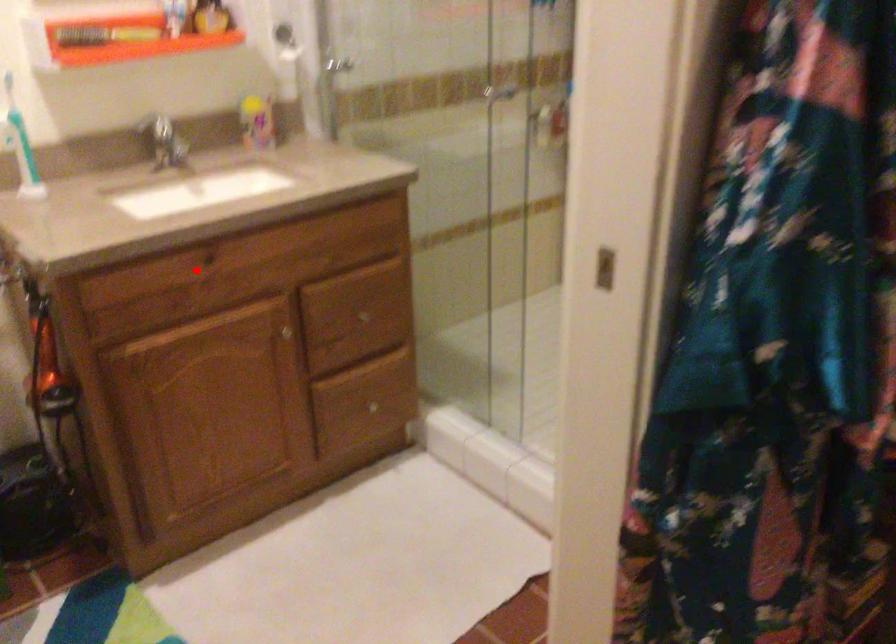
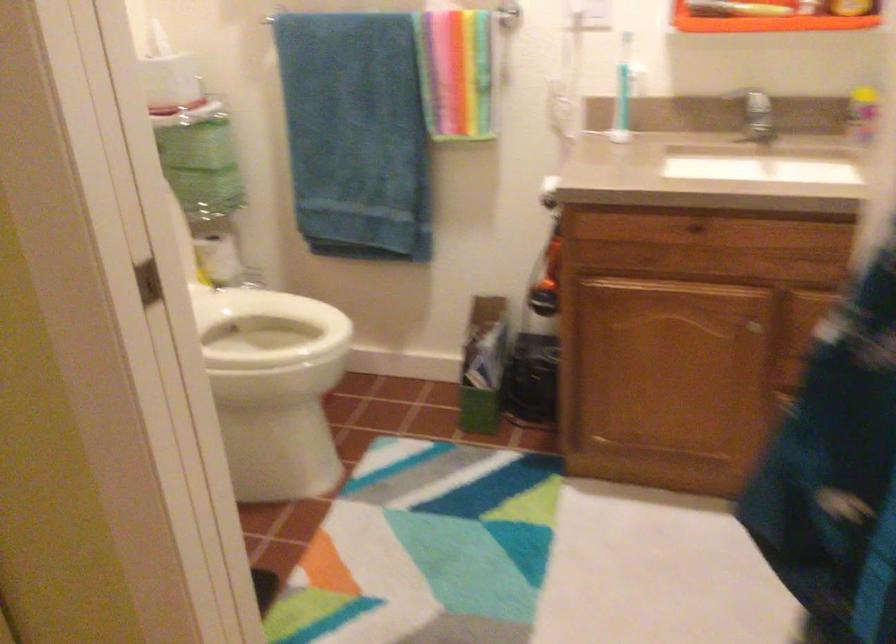
In the second image, find the point that corresponds to the highlighted location in the first image.

(692, 229)